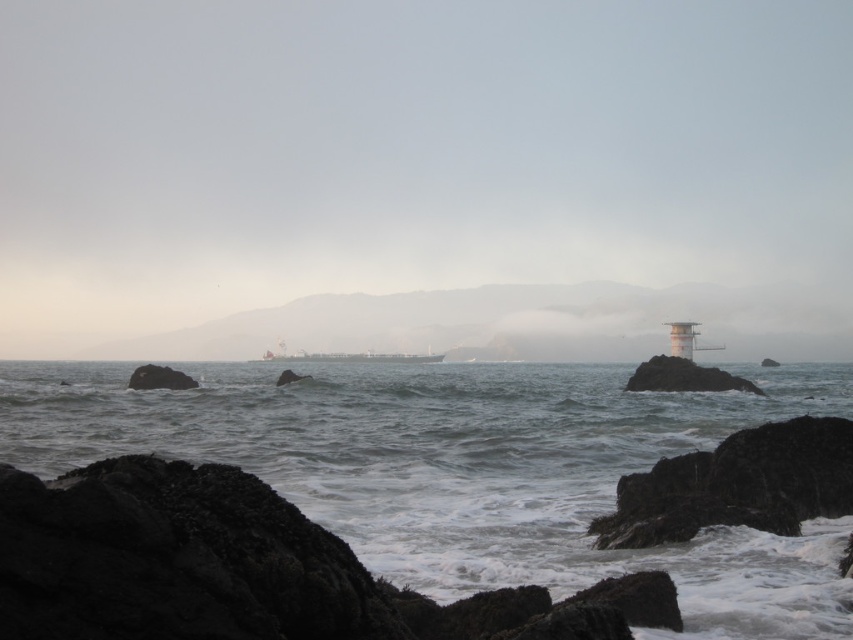
You are a sailor trying to navigate through the coastal area. You see the white foggy sky at upper center and the grayish water at center. Which one is higher in the scene?

The white foggy sky at upper center is taller than the grayish water at center, so the white foggy sky at upper center is higher in the scene.

You are a sailor navigating a boat and you see the white foggy sky at upper center and the grayish water at center. Which one is closer to you?

The grayish water at center is behind the white foggy sky at upper center, so the white foggy sky at upper center is closer to you.